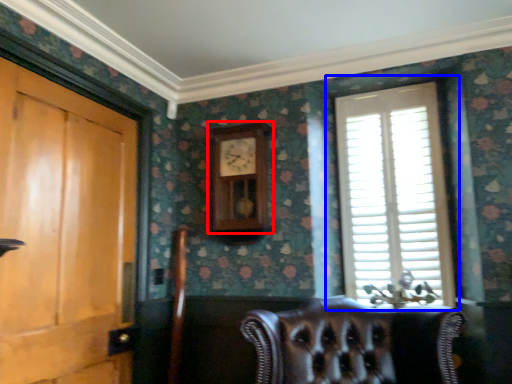
Question: Which object appears farthest to the camera in this image, clock (highlighted by a red box) or window (highlighted by a blue box)?

Choices:
 (A) clock
 (B) window

Answer: (A)